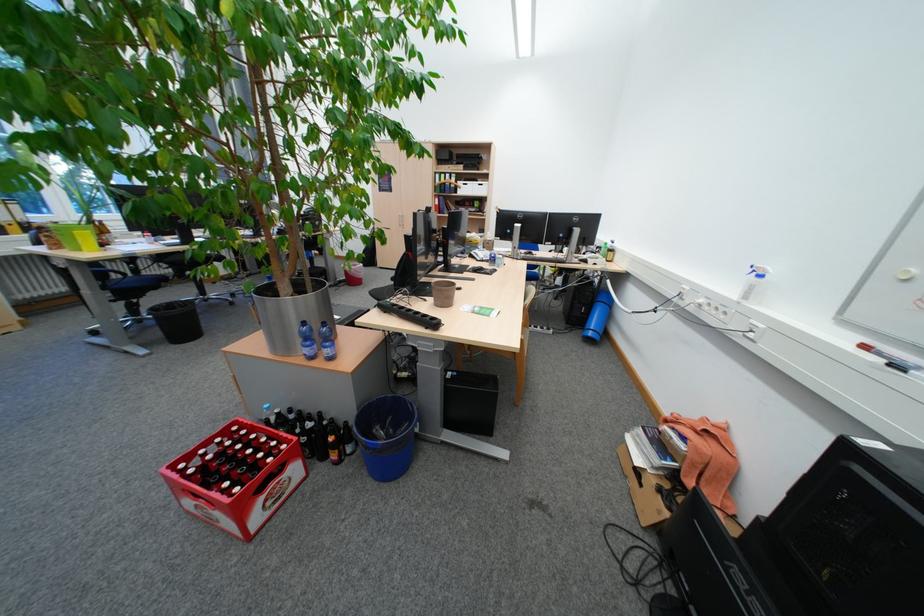
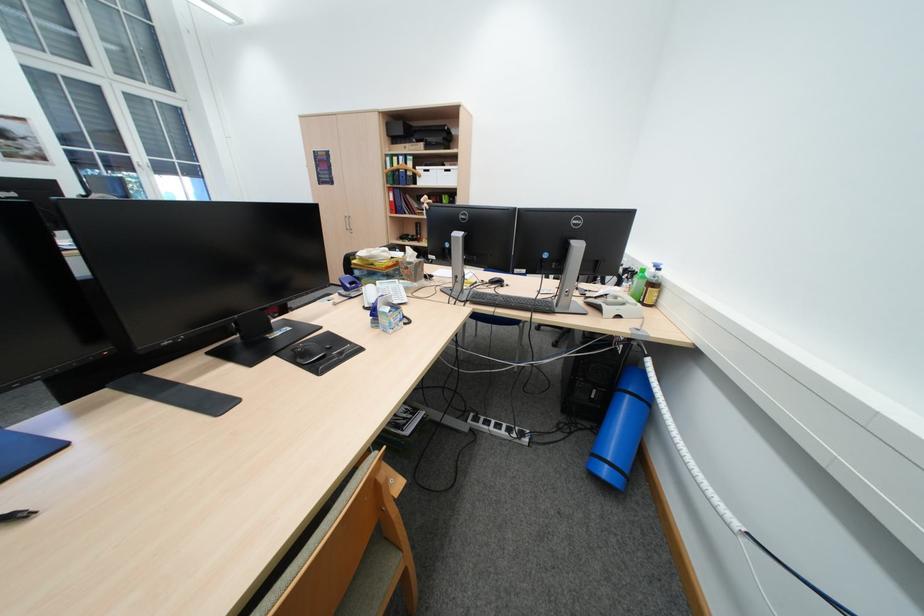
The point at (456, 175) is marked in the first image. Where is the corresponding point in the second image?

(409, 156)